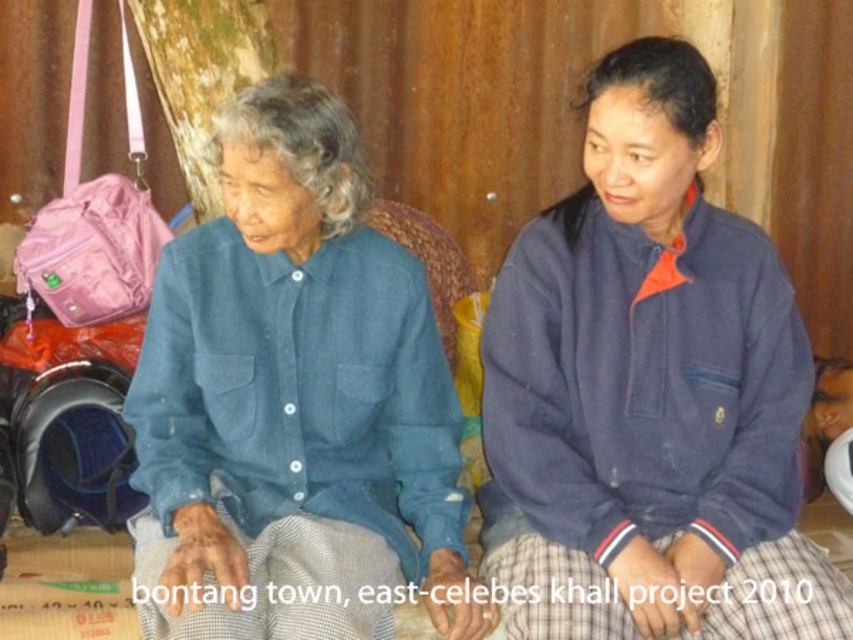
Question: In this image, where is navy blue fleece at center located relative to blue denim shirt at center?

Choices:
 (A) right
 (B) left

Answer: (A)

Question: Which object is farther from the camera taking this photo?

Choices:
 (A) blue denim shirt at center
 (B) navy blue fleece at center

Answer: (B)

Question: Which point is farther to the camera?

Choices:
 (A) (451, 627)
 (B) (746, 582)

Answer: (A)

Question: Is navy blue fleece at center below blue denim shirt at center?

Choices:
 (A) no
 (B) yes

Answer: (A)

Question: Which point is closer to the camera?

Choices:
 (A) (248, 268)
 (B) (619, 109)

Answer: (B)

Question: Does navy blue fleece at center have a larger size compared to blue denim shirt at center?

Choices:
 (A) no
 (B) yes

Answer: (A)